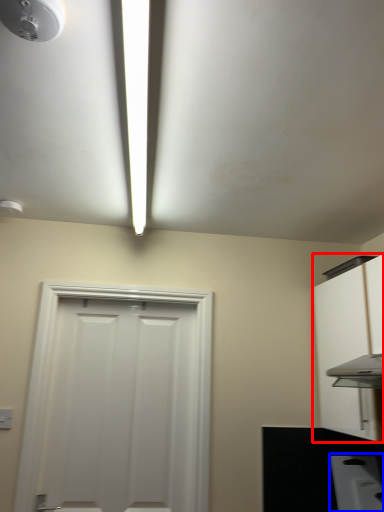
Question: Which point is closer to the camera, cabinetry (highlighted by a red box) or appliance (highlighted by a blue box)?

Choices:
 (A) cabinetry
 (B) appliance

Answer: (A)